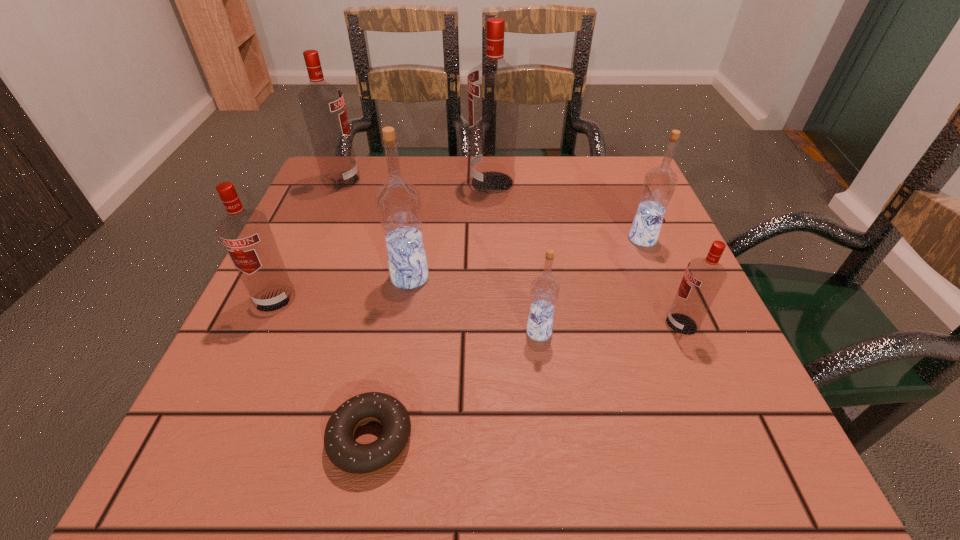
Locate an element on the screen. blue vodka that stands as the closest to the third farthest object is located at coordinates (544, 291).

Locate an element on the screen. the second closest blue vodka relative to the second farthest blue vodka is located at coordinates (659, 184).

Locate an element on the screen. This screenshot has width=960, height=540. free spot that satisfies the following two spatial constraints: 1. on the front label of the shortest object; 2. on the right side of the third smallest red vodka is located at coordinates [233, 439].

The image size is (960, 540). I want to click on free region that satisfies the following two spatial constraints: 1. on the front label of the biggest red vodka; 2. on the back side of the farthest blue vodka, so click(494, 239).

Where is `vacant area that satisfies the following two spatial constraints: 1. on the front label of the third red vodka from left to right; 2. on the front label of the second smallest red vodka`? The width and height of the screenshot is (960, 540). vacant area that satisfies the following two spatial constraints: 1. on the front label of the third red vodka from left to right; 2. on the front label of the second smallest red vodka is located at coordinates (496, 299).

You are a GUI agent. You are given a task and a screenshot of the screen. Output one action in this format:
    pyautogui.click(x=<x>, y=<y>)
    Task: Click on the free space that satisfies the following two spatial constraints: 1. on the front label of the nearest object; 2. on the right side of the second smallest red vodka
    This screenshot has width=960, height=540.
    Given the screenshot: What is the action you would take?
    pyautogui.click(x=211, y=439)

Locate an element on the screen. free space that satisfies the following two spatial constraints: 1. on the front side of the second nearest blue vodka; 2. on the right side of the nearest blue vodka is located at coordinates (401, 332).

Locate an element on the screen. This screenshot has width=960, height=540. blank space that satisfies the following two spatial constraints: 1. on the front label of the third smallest red vodka; 2. on the back side of the second blue vodka from left to right is located at coordinates (278, 332).